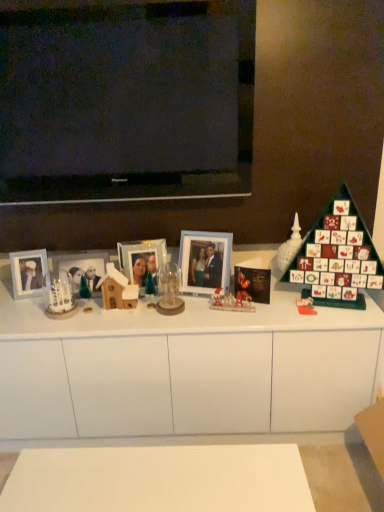
At what (x,y) coordinates should I click in order to perform the action: click on vacant area located to the right-hand side of white frosted glass candle holder at left. Please return your answer as a coordinate pair (x, y). Looking at the image, I should click on (95, 314).